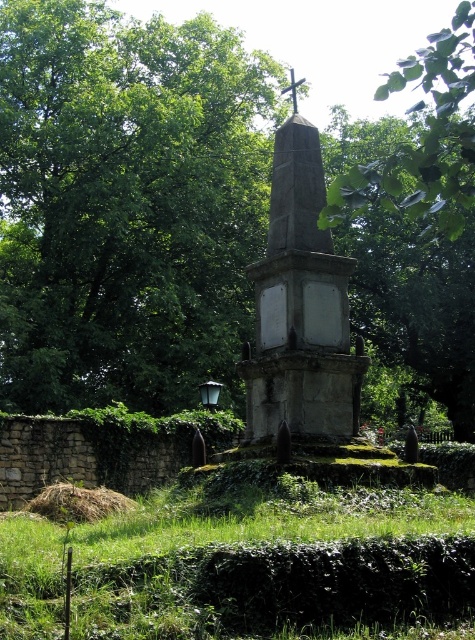
Is green grass at lower center positioned in front of gray stone monument at center?

That is True.

Between green grass at lower center and gray stone monument at center, which one has more height?

With more height is gray stone monument at center.

Does point (123, 564) lie in front of point (249, 410)?

Yes, point (123, 564) is in front of point (249, 410).

This screenshot has width=475, height=640. In order to click on green grass at lower center in this screenshot , I will do [237, 552].

What do you see at coordinates (126, 204) in the screenshot? The width and height of the screenshot is (475, 640). I see `green leafy tree at center` at bounding box center [126, 204].

Which is more to the left, green leafy tree at center or green grass at lower center?

Positioned to the left is green grass at lower center.

Is point (229, 125) farther from viewer compared to point (126, 605)?

Yes, it is.

Locate an element on the screen. The width and height of the screenshot is (475, 640). green leafy tree at center is located at coordinates (126, 204).

Consider the image. Who is higher up, green leafy tree at center or gray stone monument at center?

green leafy tree at center is higher up.

The width and height of the screenshot is (475, 640). Find the location of `green leafy tree at center`. green leafy tree at center is located at coordinates (126, 204).